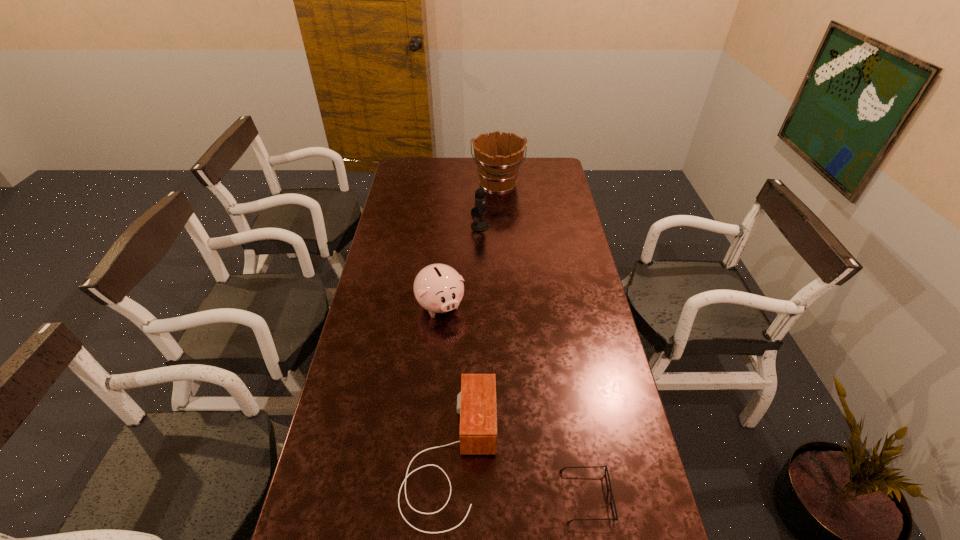
The image size is (960, 540). In order to click on the tallest object in this screenshot , I will do `click(498, 157)`.

Image resolution: width=960 pixels, height=540 pixels. Find the location of `the farthest object`. the farthest object is located at coordinates (498, 157).

Where is `microphone`? The width and height of the screenshot is (960, 540). microphone is located at coordinates (479, 210).

Identify the location of piggy bank. (438, 288).

Image resolution: width=960 pixels, height=540 pixels. Find the location of `the fourth tallest object`. the fourth tallest object is located at coordinates click(x=476, y=403).

Where is `spectacles`? This screenshot has height=540, width=960. spectacles is located at coordinates (615, 518).

You are a GUI agent. You are given a task and a screenshot of the screen. Output one action in this format:
    pyautogui.click(x=<x>, y=<y>)
    Task: Click on the free space located 0.130m with the handle on the farthest object
    The width and height of the screenshot is (960, 540).
    Given the screenshot: What is the action you would take?
    pyautogui.click(x=499, y=213)

Identify the location of vacant space positioned 0.360m on the back of the second farthest object. (480, 179).

Find the location of a particular element. This screenshot has width=960, height=540. vacant region located on the left of the third nearest object is located at coordinates (399, 305).

You are a GUI agent. You are given a task and a screenshot of the screen. Output one action in this format:
    pyautogui.click(x=<x>, y=<y>)
    Task: Click on the free space located 0.230m on the front-facing side of the second shortest object
    This screenshot has width=960, height=540.
    Given the screenshot: What is the action you would take?
    pyautogui.click(x=583, y=456)